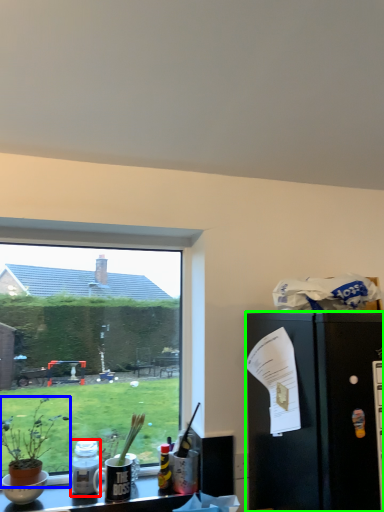
Question: Which object is positioned closest to bottle (highlighted by a red box)? Select from houseplant (highlighted by a blue box) and refrigerator (highlighted by a green box).

Choices:
 (A) houseplant
 (B) refrigerator

Answer: (A)